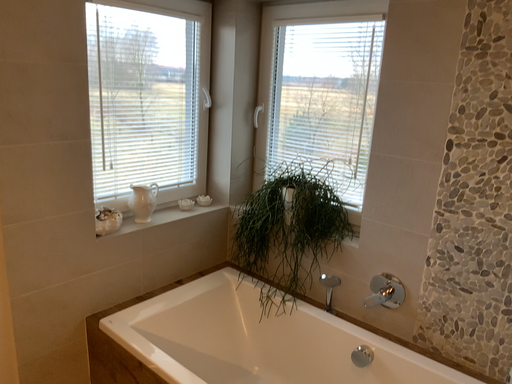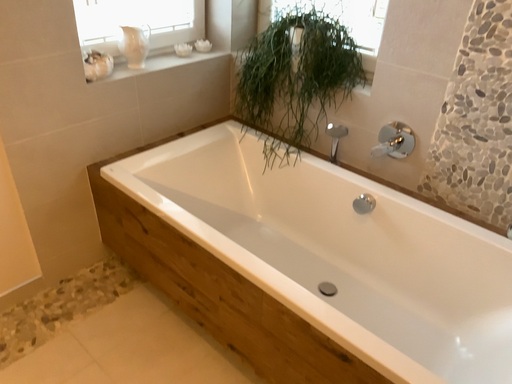
Question: How did the camera likely rotate when shooting the video?

Choices:
 (A) rotated downward
 (B) rotated upward

Answer: (A)